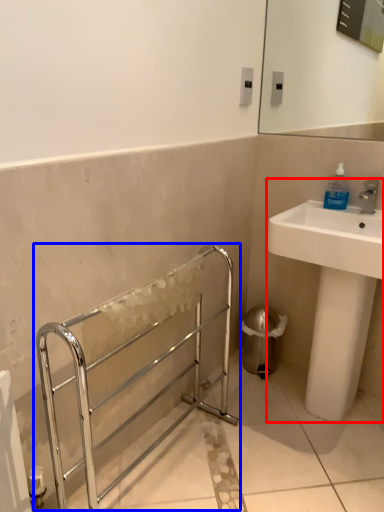
Question: Among these objects, which one is nearest to the camera, sink (highlighted by a red box) or balustrade (highlighted by a blue box)?

Choices:
 (A) sink
 (B) balustrade

Answer: (B)